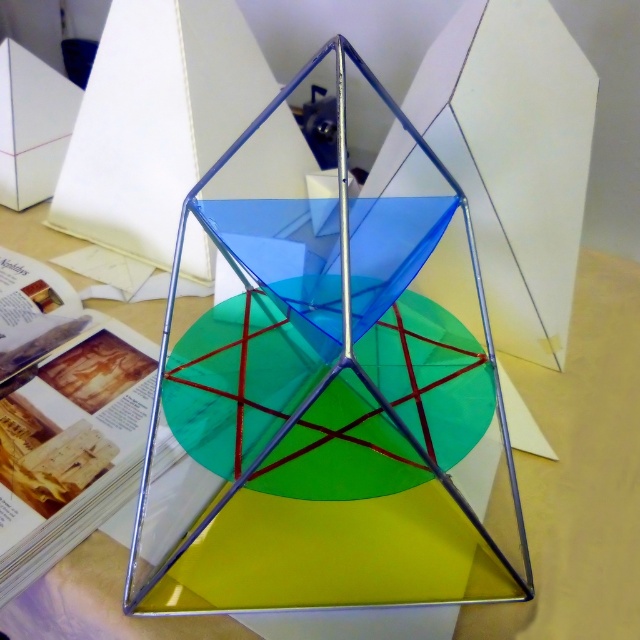
Who is more forward, [196,496] or [580,470]?

Point [196,496]

Does transparent glass cube at center appear on the right side of transparent glass table at center?

Incorrect, transparent glass cube at center is not on the right side of transparent glass table at center.

Is point (220, 525) behind point (563, 632)?

Yes, point (220, 525) is farther from viewer.

Find the location of `transparent glass cube at center`. transparent glass cube at center is located at coordinates (323, 412).